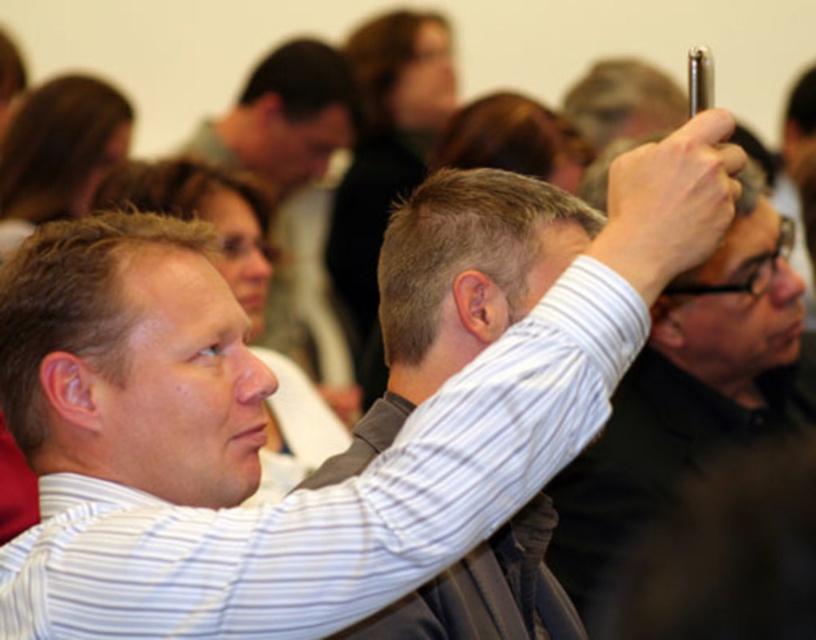
You are a photographer trying to capture a clear shot of the light brown hair at center and the short blonde hair at upper center during this event. Based on their positions, which person is closer to the camera?

The light brown hair at center has a lesser height compared to short blonde hair at upper center, which indicates it is closer to the camera.

Based on the scene description, can you determine the relative positions of the light brown hair at center and the short blonde hair at upper center?

The light brown hair at center is located below the short blonde hair at upper center.